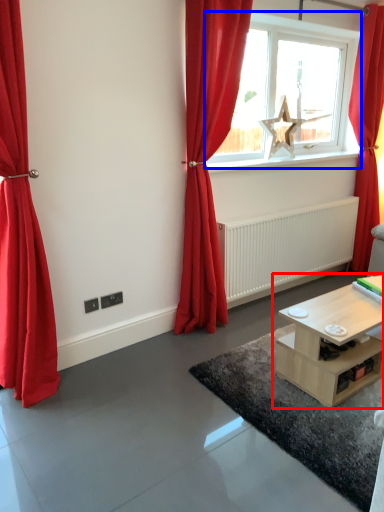
Question: Among these objects, which one is farthest to the camera, table (highlighted by a red box) or window (highlighted by a blue box)?

Choices:
 (A) table
 (B) window

Answer: (B)